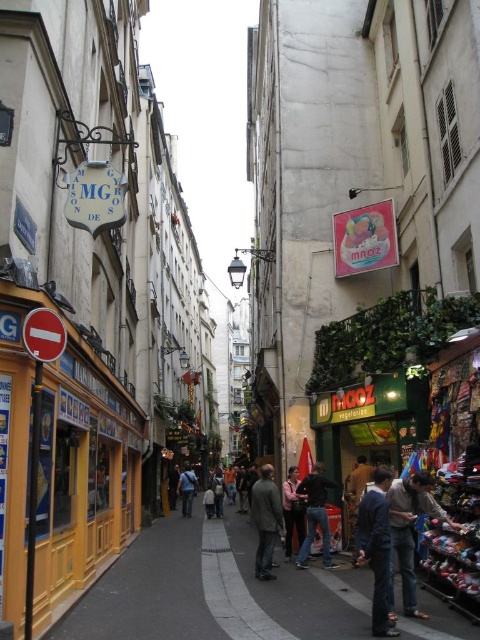
Can you confirm if dark blue jeans at center is thinner than pink fabric at center?

No.

Does point (319, 508) lie behind point (303, 504)?

No.

The width and height of the screenshot is (480, 640). Describe the element at coordinates (315, 515) in the screenshot. I see `dark blue jeans at center` at that location.

Where is `dark blue jeans at center`? This screenshot has height=640, width=480. dark blue jeans at center is located at coordinates (315, 515).

The height and width of the screenshot is (640, 480). I want to click on smooth concrete pavement at center, so click(215, 592).

Can you confirm if smooth concrete pavement at center is shorter than pink fabric at center?

No.

Which is in front, point (109, 621) or point (288, 500)?

Point (109, 621) is in front.

What are the coordinates of `smooth concrete pavement at center` in the screenshot? It's located at (215, 592).

Is smooth concrete pavement at center to the right of dark blue jeans at center from the viewer's perspective?

Incorrect, smooth concrete pavement at center is not on the right side of dark blue jeans at center.

Between smooth concrete pavement at center and dark blue jeans at center, which one has less height?

Standing shorter between the two is dark blue jeans at center.

Between point (95, 612) and point (305, 550), which one is positioned in front?

Point (95, 612) is in front.

In order to click on smooth concrete pavement at center in this screenshot , I will do `click(215, 592)`.